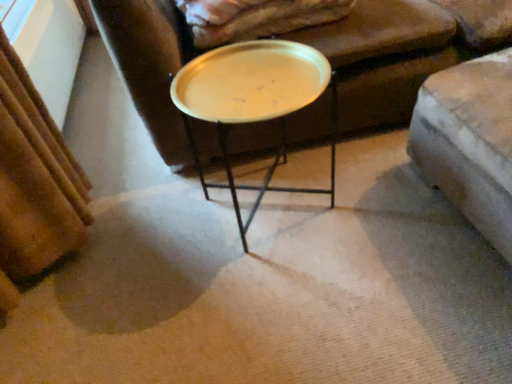
Question: In the image, is metallic gold tray at center positioned in front of or behind velvet beige blanket at upper center?

Choices:
 (A) front
 (B) behind

Answer: (A)

Question: Considering the positions of metallic gold tray at center and velvet beige blanket at upper center in the image, is metallic gold tray at center wider or thinner than velvet beige blanket at upper center?

Choices:
 (A) thin
 (B) wide

Answer: (A)

Question: Is metallic gold tray at center taller or shorter than velvet beige blanket at upper center?

Choices:
 (A) tall
 (B) short

Answer: (A)

Question: From the image's perspective, relative to metallic gold tray at center, is velvet beige blanket at upper center above or below?

Choices:
 (A) below
 (B) above

Answer: (B)

Question: Is point (347, 8) positioned closer to the camera than point (245, 86)?

Choices:
 (A) closer
 (B) farther

Answer: (B)

Question: Would you say velvet beige blanket at upper center is to the left or to the right of metallic gold tray at center in the picture?

Choices:
 (A) right
 (B) left

Answer: (A)

Question: Is velvet beige blanket at upper center taller or shorter than metallic gold tray at center?

Choices:
 (A) short
 (B) tall

Answer: (A)